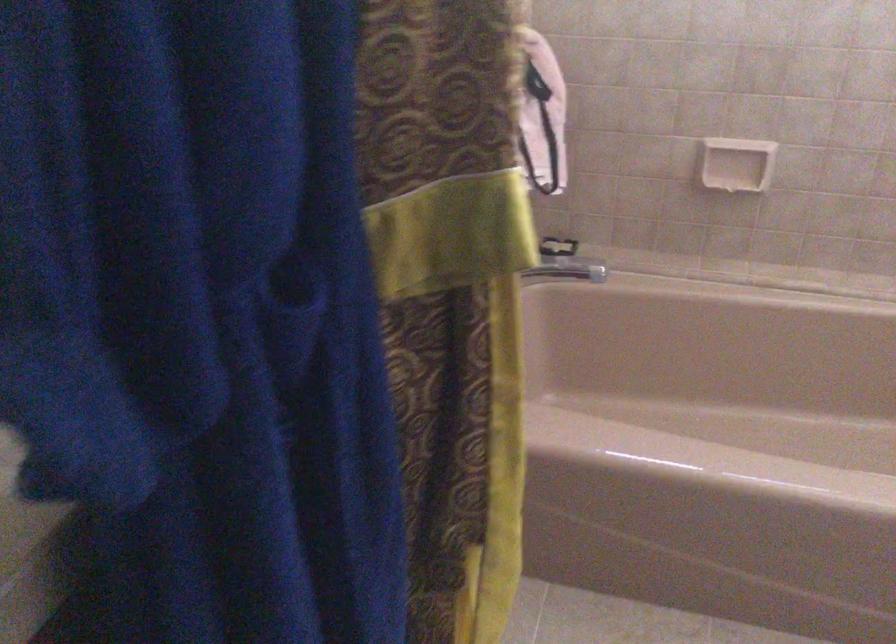
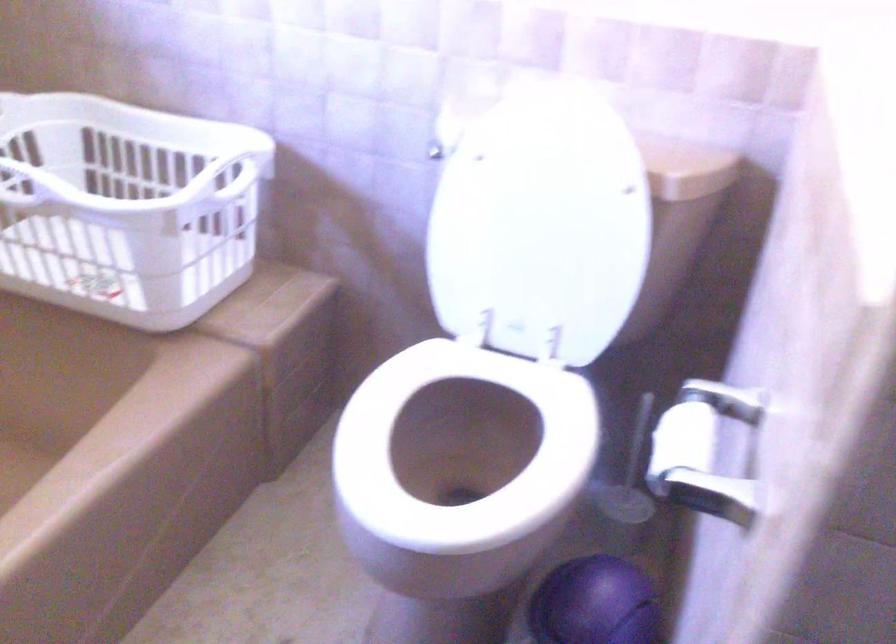
First-person continuous shooting, in which direction is the camera rotating?

The camera's rotation is toward right-down.